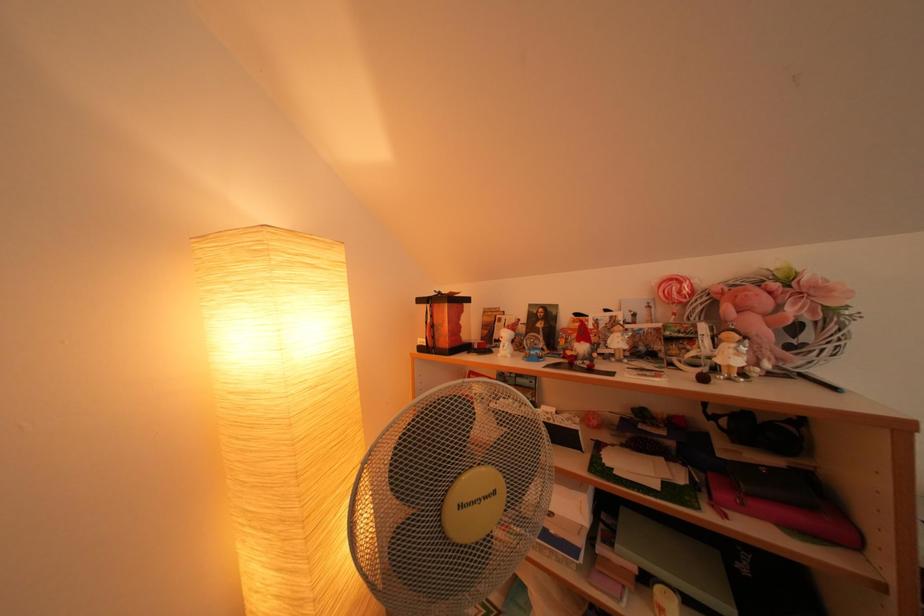
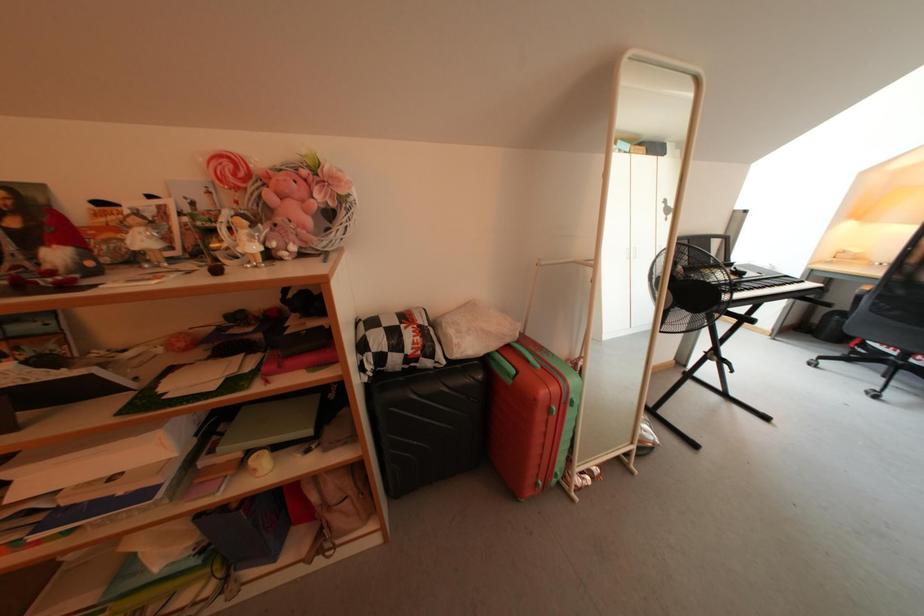
First-person continuous shooting, in which direction is the camera rotating?

The camera's rotation is toward right-down.